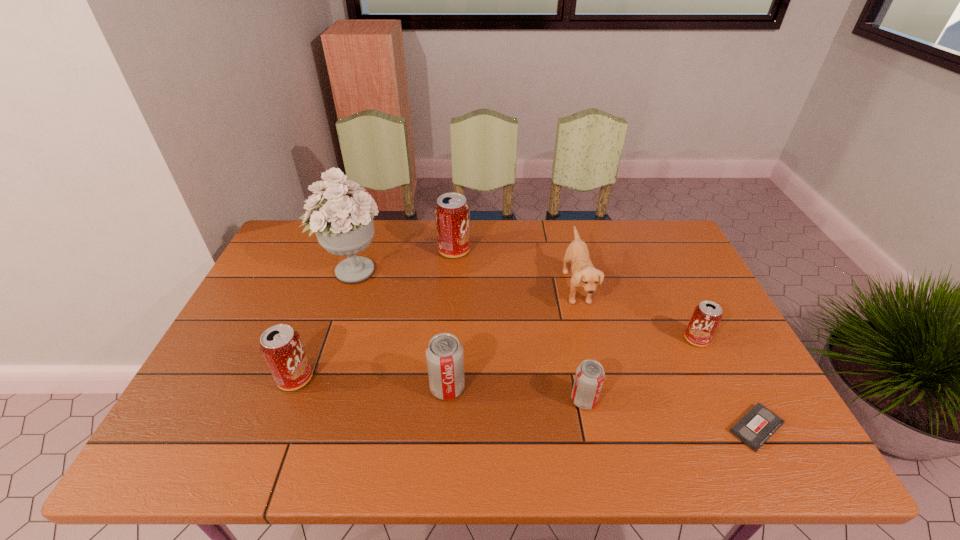
Image resolution: width=960 pixels, height=540 pixels. Find the location of `vacant area located on the front of the fifth nearest object`. vacant area located on the front of the fifth nearest object is located at coordinates (740, 429).

Image resolution: width=960 pixels, height=540 pixels. What are the coordinates of `free location located on the back of the fourth soda can from left to right` in the screenshot? It's located at (568, 321).

The width and height of the screenshot is (960, 540). In order to click on vacant space located on the back of the shortest object in this screenshot , I will do `click(708, 334)`.

Find the location of a particular element. This screenshot has width=960, height=540. bouquet present at the far edge is located at coordinates (344, 226).

Where is `soda can positioned at the far edge`? soda can positioned at the far edge is located at coordinates (452, 213).

Locate an element on the screen. Image resolution: width=960 pixels, height=540 pixels. puppy located in the far edge section of the desktop is located at coordinates (584, 275).

Where is `object positioned at the near edge`? The width and height of the screenshot is (960, 540). object positioned at the near edge is located at coordinates (759, 423).

Find the location of a particular element. object present at the left edge is located at coordinates (344, 226).

Where is `soda can situated at the right edge`? soda can situated at the right edge is located at coordinates (706, 317).

Find the location of `videotape that is at the right edge`. videotape that is at the right edge is located at coordinates (x=759, y=423).